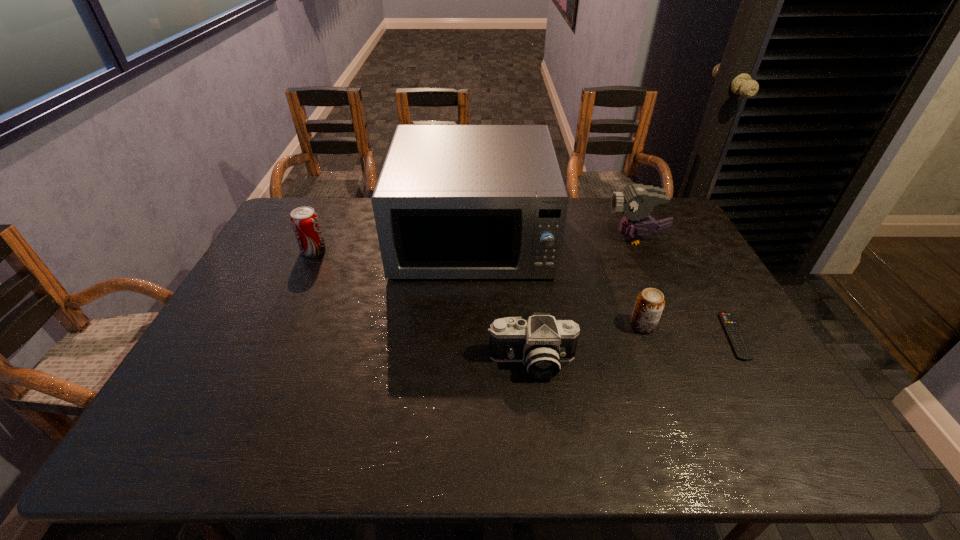
Where is `free space located at the beak of the bird`? The width and height of the screenshot is (960, 540). free space located at the beak of the bird is located at coordinates (559, 239).

This screenshot has width=960, height=540. I want to click on vacant space situated on the back of the soda can, so click(333, 207).

The image size is (960, 540). I want to click on vacant space located 0.070m on the back of the camera, so click(x=527, y=324).

Image resolution: width=960 pixels, height=540 pixels. Find the location of `free spot located 0.060m on the front of the fifth tallest object`. free spot located 0.060m on the front of the fifth tallest object is located at coordinates (653, 353).

This screenshot has height=540, width=960. What are the coordinates of `vacant space located on the left of the remote control` in the screenshot? It's located at (683, 336).

You are a GUI agent. You are given a task and a screenshot of the screen. Output one action in this format:
    pyautogui.click(x=<x>, y=<y>)
    Task: Click on the microwave oven at the far edge
    The image size is (960, 540).
    Given the screenshot: What is the action you would take?
    pyautogui.click(x=452, y=201)

I want to click on bird that is positioned at the far edge, so click(637, 201).

Image resolution: width=960 pixels, height=540 pixels. I want to click on object at the left edge, so (304, 220).

The height and width of the screenshot is (540, 960). Identify the location of bird located at the right edge. (637, 201).

At what (x,y) coordinates should I click in order to perform the action: click on remote control present at the right edge. Please return your answer as a coordinate pair (x, y). Looking at the image, I should click on (733, 332).